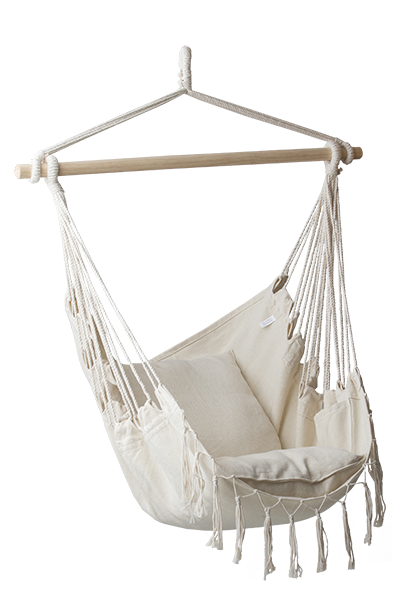
This screenshot has width=400, height=600. I want to click on hammock seat bottom cushion, so click(x=267, y=479).